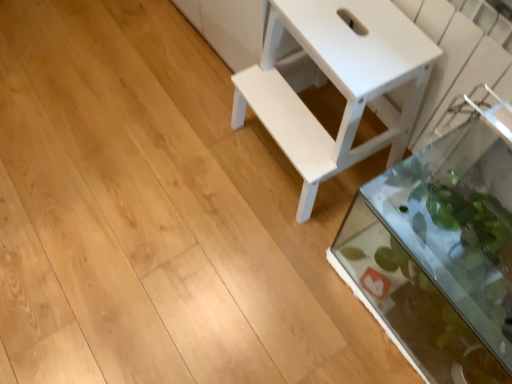
Question: Relative to transparent glass tank at lower right, is white matte table at center in front or behind?

Choices:
 (A) behind
 (B) front

Answer: (A)

Question: From a real-world perspective, is white matte table at center physically located above or below transparent glass tank at lower right?

Choices:
 (A) below
 (B) above

Answer: (B)

Question: Would you say white matte table at center is inside or outside transparent glass tank at lower right?

Choices:
 (A) outside
 (B) inside

Answer: (A)

Question: Is transparent glass tank at lower right spatially inside white matte table at center, or outside of it?

Choices:
 (A) outside
 (B) inside

Answer: (A)

Question: Is transparent glass tank at lower right in front of or behind white matte table at center in the image?

Choices:
 (A) behind
 (B) front

Answer: (B)

Question: From their relative heights in the image, would you say transparent glass tank at lower right is taller or shorter than white matte table at center?

Choices:
 (A) tall
 (B) short

Answer: (B)

Question: Considering the relative positions of transparent glass tank at lower right and white matte table at center in the image provided, is transparent glass tank at lower right to the left or to the right of white matte table at center?

Choices:
 (A) right
 (B) left

Answer: (A)